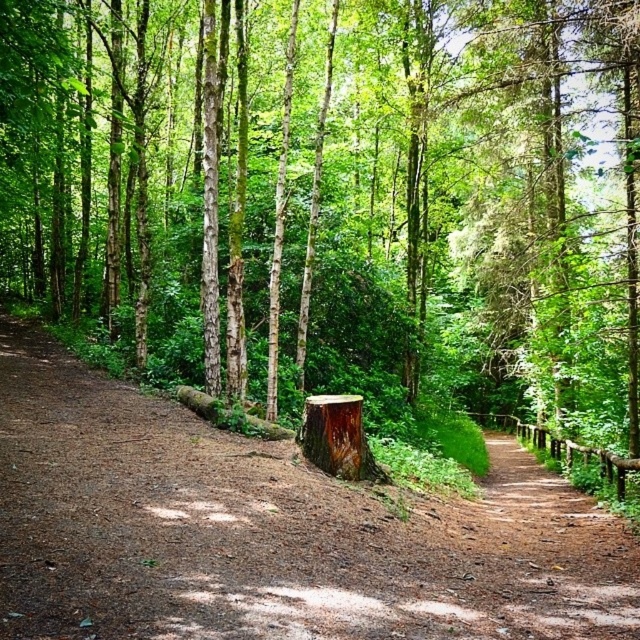
Is brown rough tree stump at center shorter than brown dirt path at center?

No.

Is point (232, 221) positioned after point (19, 600)?

Yes.

This screenshot has width=640, height=640. I want to click on brown rough tree stump at center, so click(333, 198).

Based on the photo, can you confirm if brown rough tree stump at center is positioned above rough wood stump at center?

Correct, brown rough tree stump at center is located above rough wood stump at center.

Is point (497, 8) behind point (310, 461)?

Yes, point (497, 8) is behind point (310, 461).

At what (x,y) coordinates should I click in order to perform the action: click on brown rough tree stump at center. Please return your answer as a coordinate pair (x, y). Looking at the image, I should click on (333, 198).

Does brown dirt path at center come in front of rough wood stump at center?

Yes.

Can you confirm if brown dirt path at center is positioned above rough wood stump at center?

Actually, brown dirt path at center is below rough wood stump at center.

Describe the element at coordinates (269, 531) in the screenshot. I see `brown dirt path at center` at that location.

The height and width of the screenshot is (640, 640). I want to click on brown dirt path at center, so click(269, 531).